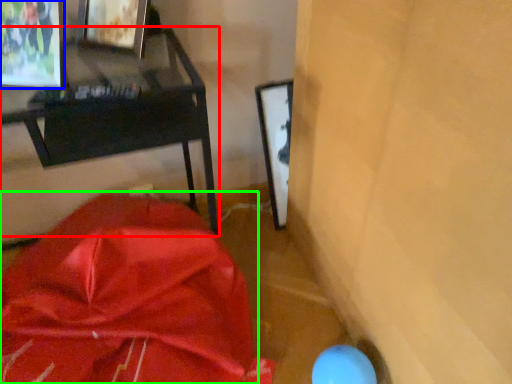
Question: Which is nearer to the furniture (highlighted by a red box)? picture frame (highlighted by a blue box) or wrap (highlighted by a green box).

Choices:
 (A) picture frame
 (B) wrap

Answer: (A)